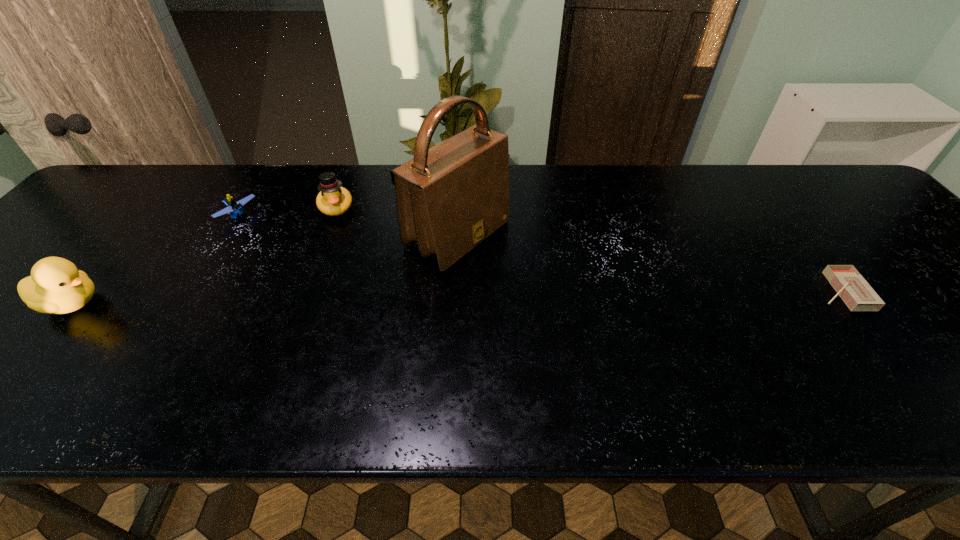
What are the coordinates of `free space located on the front-facing side of the Lego` in the screenshot? It's located at (322, 274).

Where is `vacant space located on the front-facing side of the Lego`? vacant space located on the front-facing side of the Lego is located at coordinates (303, 261).

You are a GUI agent. You are given a task and a screenshot of the screen. Output one action in this format:
    pyautogui.click(x=<x>, y=<y>)
    Task: Click on the free space located on the front-facing side of the Lego
    
    Given the screenshot: What is the action you would take?
    pyautogui.click(x=257, y=231)

What are the coordinates of `duck positioned at the far edge` in the screenshot? It's located at (333, 200).

I want to click on shoulder bag present at the far edge, so click(451, 197).

In order to click on Lego that is at the far edge in this screenshot , I will do `click(234, 208)`.

Where is `object that is positioned at the left edge`? The width and height of the screenshot is (960, 540). object that is positioned at the left edge is located at coordinates (56, 286).

Where is `vacant area at the far edge of the desktop`? This screenshot has width=960, height=540. vacant area at the far edge of the desktop is located at coordinates (226, 196).

Locate an element on the screen. The image size is (960, 540). free space at the near edge is located at coordinates 531,341.

In the image, there is a desktop. What are the coordinates of `vacant space at the left edge` in the screenshot? It's located at (35, 316).